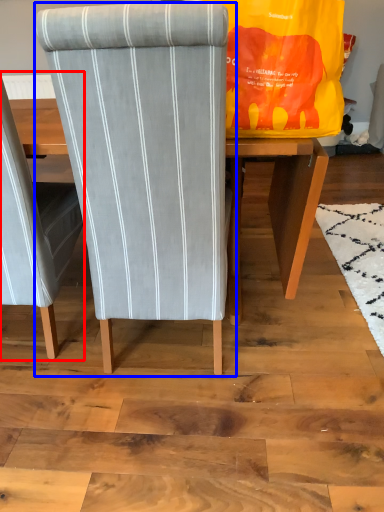
Question: Which object is closer to the camera taking this photo, chair (highlighted by a red box) or chair (highlighted by a blue box)?

Choices:
 (A) chair
 (B) chair

Answer: (B)